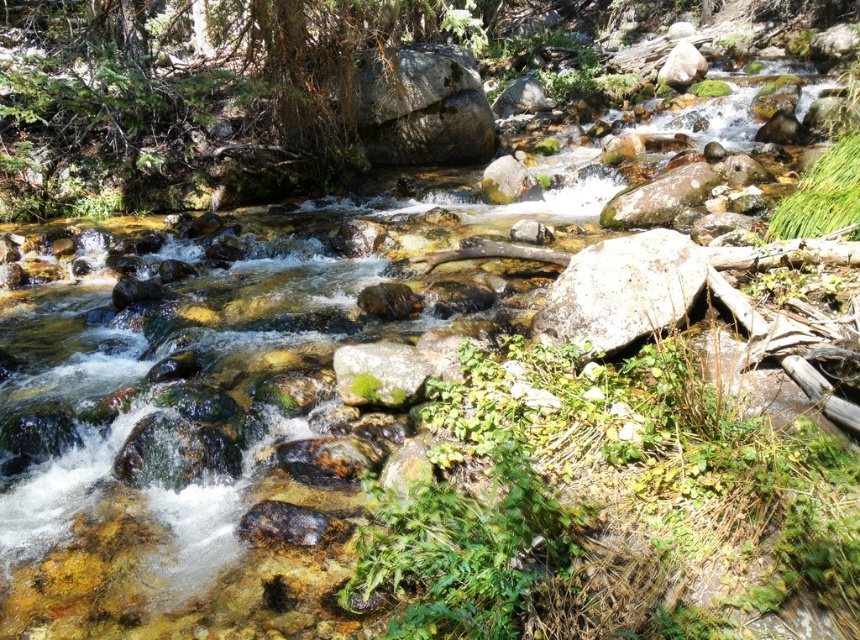
Is white textured rock at center shorter than green mossy rock at center?

Incorrect, white textured rock at center's height does not fall short of green mossy rock at center's.

Between point (642, 276) and point (347, 378), which one is positioned in front?

Point (642, 276) is more forward.

Find the location of a particular element. white textured rock at center is located at coordinates (622, 291).